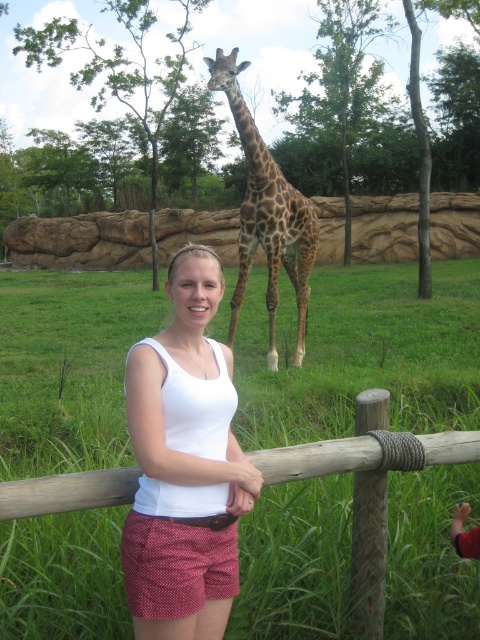
You are a zookeeper who needs to ensure the wooden post at center is visible to visitors for safety instructions. Given the spotted fur giraffe at center is in the way, can the post still be seen by someone standing where the woman is?

The wooden post at center occupies less space than the spotted fur giraffe at center, meaning the giraffe is larger. Since the giraffe is in front, it may block the view of the smaller post. The post might not be fully visible to visitors from the woman s position.